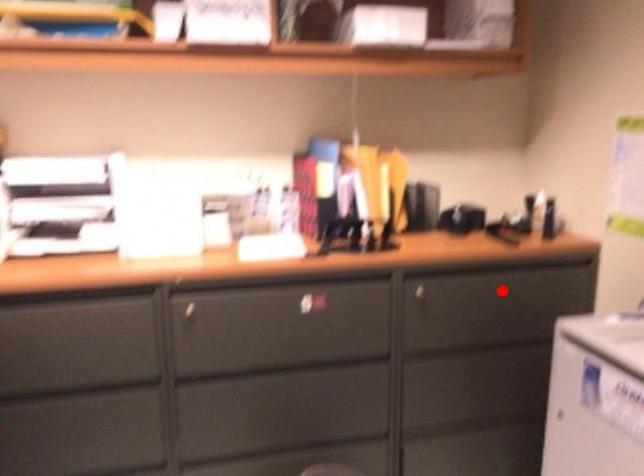
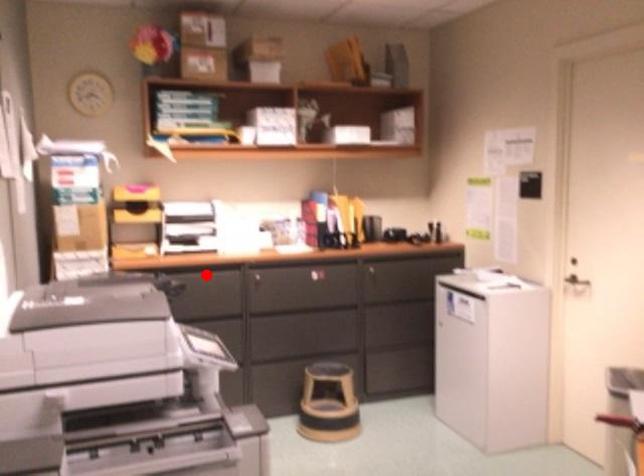
I am providing you with two images of the same scene from different viewpoints. A red point is marked on the first image and another point is marked on the second image. Does the point marked in image1 correspond to the same location as the one in image2?

No